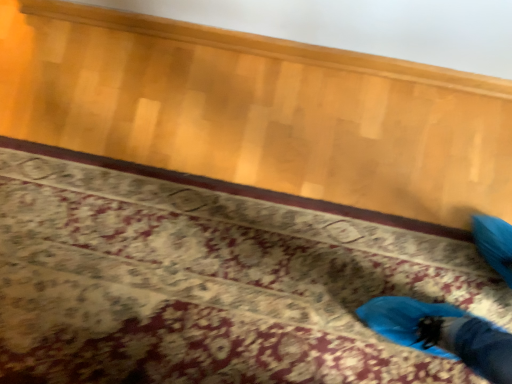
Locate an element on the screen. free space to the back side of patterned carpet at center is located at coordinates (198, 117).